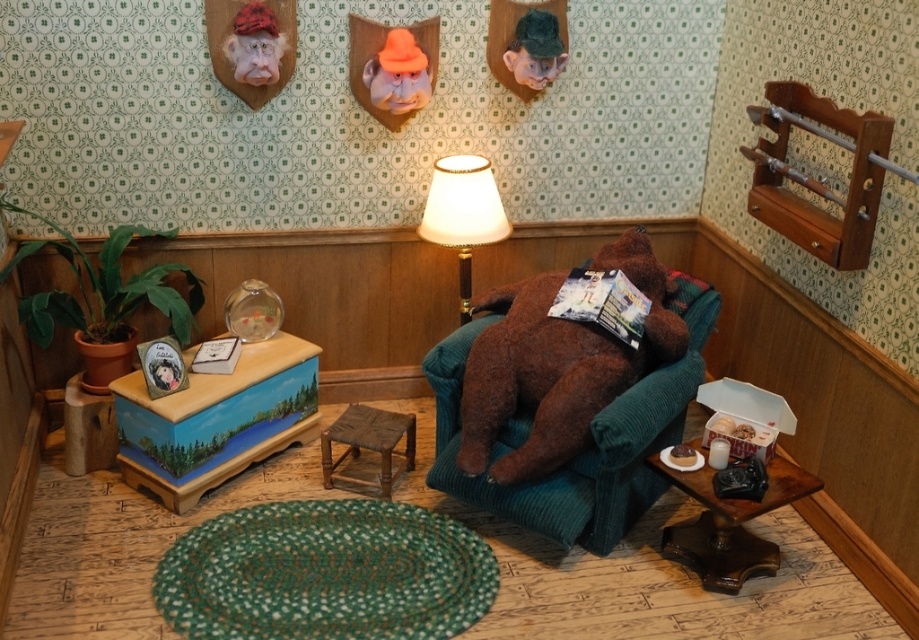
Who is higher up, brown plush bear at center or white fabric lampshade at center?

white fabric lampshade at center is higher up.

What do you see at coordinates (557, 365) in the screenshot?
I see `brown plush bear at center` at bounding box center [557, 365].

This screenshot has height=640, width=919. What do you see at coordinates (557, 365) in the screenshot?
I see `brown plush bear at center` at bounding box center [557, 365].

Locate an element on the screen. The image size is (919, 640). brown plush bear at center is located at coordinates (557, 365).

Who is positioned more to the left, brown plush bear at center or rustic wood stool at center?

From the viewer's perspective, rustic wood stool at center appears more on the left side.

Is brown plush bear at center thinner than rustic wood stool at center?

No, brown plush bear at center is not thinner than rustic wood stool at center.

Image resolution: width=919 pixels, height=640 pixels. I want to click on brown plush bear at center, so click(557, 365).

Between point (433, 186) and point (384, 454), which one is positioned in front?

Point (384, 454)

Is point (483, 202) farther from viewer compared to point (393, 413)?

No, it is in front of (393, 413).

Find the location of a particular element. white fabric lampshade at center is located at coordinates (463, 212).

You are a GUI agent. You are given a task and a screenshot of the screen. Output one action in this format:
    pyautogui.click(x=<x>, y=<y>)
    Task: Click on the white fabric lampshade at center
    This screenshot has width=919, height=640.
    Given the screenshot: What is the action you would take?
    pyautogui.click(x=463, y=212)